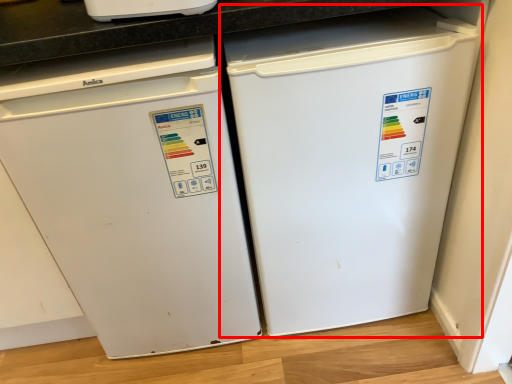
Question: From the image, what is the correct spatial relationship of refrigerator (annotated by the red box) in relation to home appliance?

Choices:
 (A) right
 (B) left

Answer: (A)